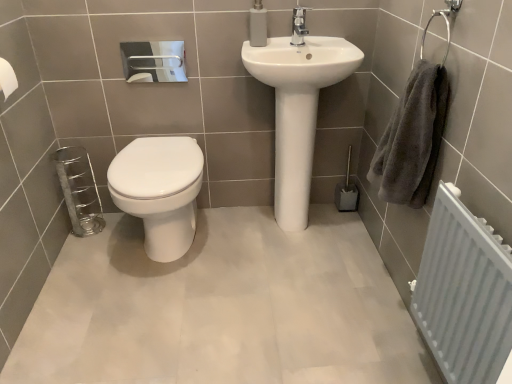
Identify the location of vacant area that lies to the right of white glossy toilet at center. The width and height of the screenshot is (512, 384). (246, 250).